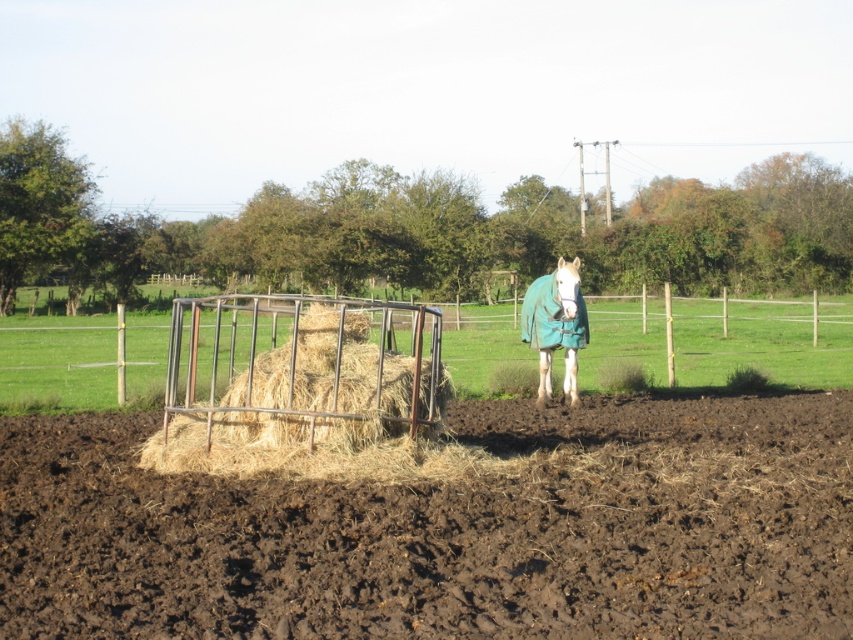
Question: Does light brown straw at center have a smaller size compared to rusty metal hay feeder at center?

Choices:
 (A) yes
 (B) no

Answer: (A)

Question: Which object is the farthest from the brown soil at lower center?

Choices:
 (A) light brown straw at center
 (B) rusty metal hay feeder at center
 (C) white fleece horse at center

Answer: (B)

Question: Can you confirm if light brown straw at center is smaller than white fleece horse at center?

Choices:
 (A) no
 (B) yes

Answer: (A)

Question: Can you confirm if light brown straw at center is positioned to the left of rusty metal hay feeder at center?

Choices:
 (A) yes
 (B) no

Answer: (A)

Question: Based on their relative distances, which object is nearer to the light brown straw at center?

Choices:
 (A) white fleece horse at center
 (B) rusty metal hay feeder at center
 (C) brown soil at lower center

Answer: (C)

Question: Which of these objects is positioned farthest from the light brown straw at center?

Choices:
 (A) brown soil at lower center
 (B) rusty metal hay feeder at center
 (C) white fleece horse at center

Answer: (B)